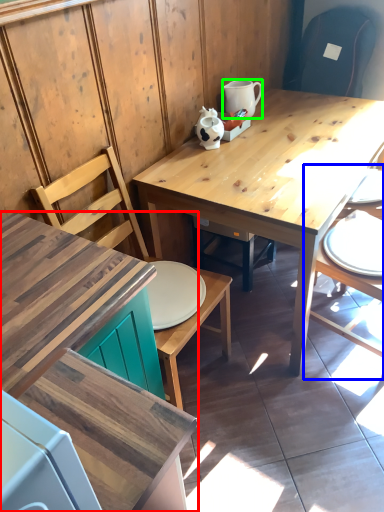
Question: Considering the real-world distances, which object is closest to desk (highlighted by a red box)? chair (highlighted by a blue box) or coffee cup (highlighted by a green box).

Choices:
 (A) chair
 (B) coffee cup

Answer: (A)